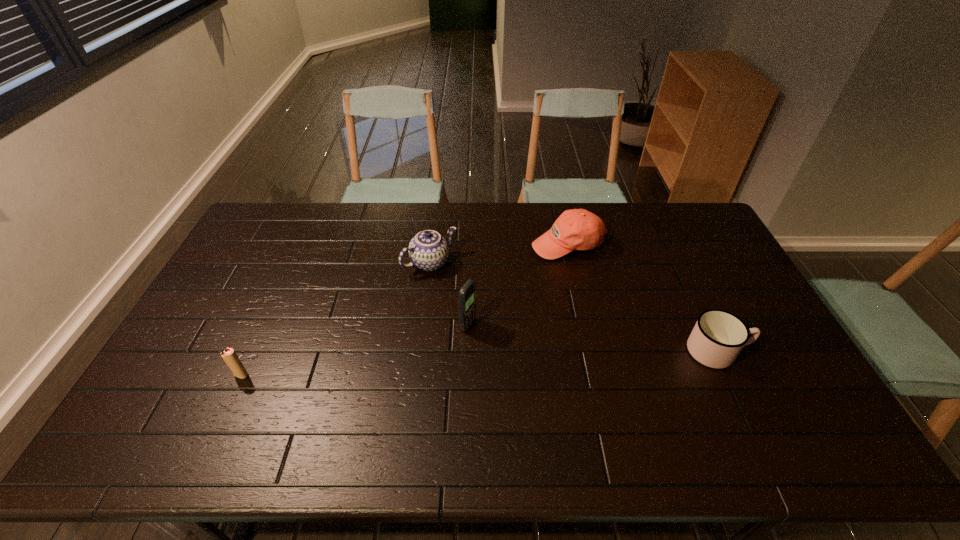
The height and width of the screenshot is (540, 960). Identify the location of free space on the desktop that is between the leftmost object and the rightmost object and is positioned on the screen of the tallest object. (548, 360).

Find the location of a particular element. This screenshot has height=540, width=960. free space on the desktop that is between the igniter and the rightmost object and is positioned at the spout of the chinaware is located at coordinates (522, 361).

This screenshot has width=960, height=540. Identify the location of vacant space on the desktop that is between the leftmost object and the rightmost object and is positioned on the front-facing side of the baseball cap. (548, 360).